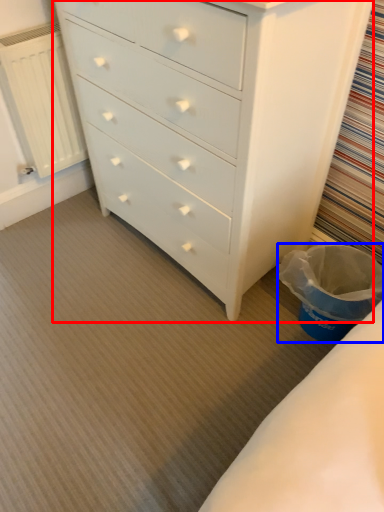
Question: Which point is closer to the camera, chest of drawers (highlighted by a red box) or laundry basket (highlighted by a blue box)?

Choices:
 (A) chest of drawers
 (B) laundry basket

Answer: (A)